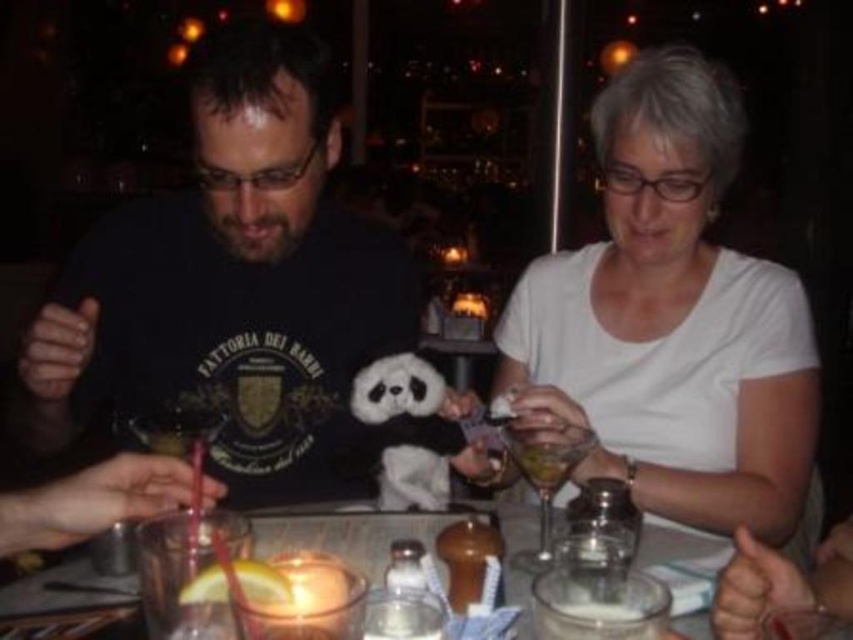
Does translucent glass at center have a smaller size compared to white plush toy at center?

No, translucent glass at center is not smaller than white plush toy at center.

Can you confirm if translucent glass at center is positioned to the right of white plush toy at center?

Yes, translucent glass at center is to the right of white plush toy at center.

Who is more forward, [515,579] or [383,376]?

Point [515,579] is in front.

I want to click on translucent glass at center, so click(345, 534).

Does black matte t-shirt at center have a greater height compared to translucent glass at lower center?

Yes.

Between point (257, 292) and point (547, 490), which one is positioned behind?

Point (257, 292)

Is point (281, 212) positioned behind point (543, 458)?

Yes, it is behind point (543, 458).

Find the location of a particular element. Image resolution: width=853 pixels, height=640 pixels. black matte t-shirt at center is located at coordinates (235, 285).

Between point (363, 403) and point (560, 627), which one is positioned behind?

The point (363, 403) is behind.

Measure the distance between white plush toy at center and camera.

white plush toy at center is 38.07 inches away from camera.

Locate an element on the screen. This screenshot has height=640, width=853. white plush toy at center is located at coordinates (396, 388).

Locate an element on the screen. Image resolution: width=853 pixels, height=640 pixels. white plush toy at center is located at coordinates (396, 388).